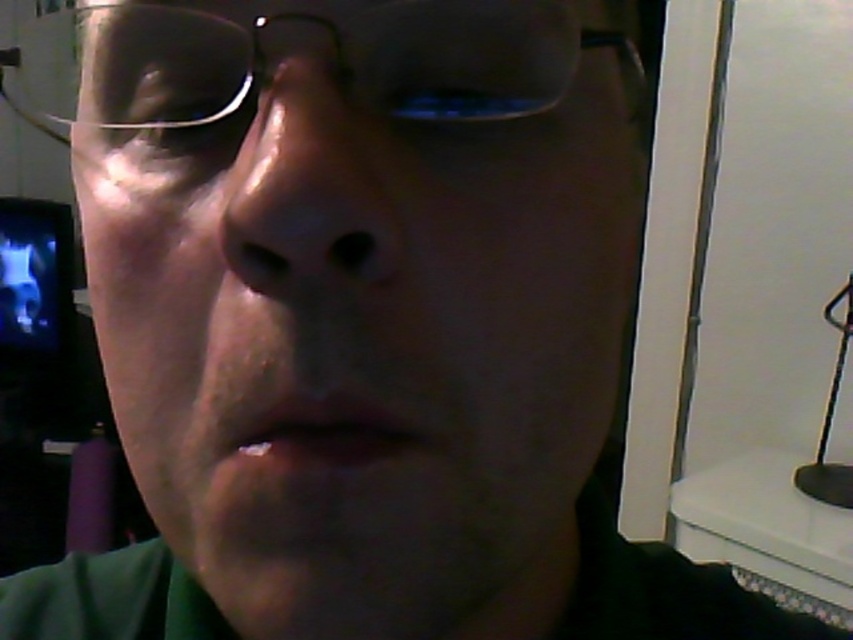
You are a photographer adjusting your camera to focus on two points in the image. The first point is at coordinates point (341, 544) and the second point is at point (309, 80). Which point is closer to the camera lens?

Point (341, 544) is further to the viewer than point (309, 80), so the second point is closer to the camera lens.

You are a photographer trying to capture a closeup of the green matte face at center and the smooth skin nose at center. Since the lighting is dim, you need to adjust your camera settings. Which object should you focus on first to ensure clarity, the larger one or the smaller one?

The green matte face at center is bigger than smooth skin nose at center, so you should focus on the larger green matte face at center first to ensure clarity.

From the picture: You are a photographer adjusting lighting for a portrait. You notice the green matte face at center and the clear plastic glasses at upper center in your frame. Which object should you focus on first if you want to ensure the larger subject is properly lit?

The clear plastic glasses at upper center should be focused on first because it is larger than the green matte face at center, ensuring proper lighting on the bigger subject.